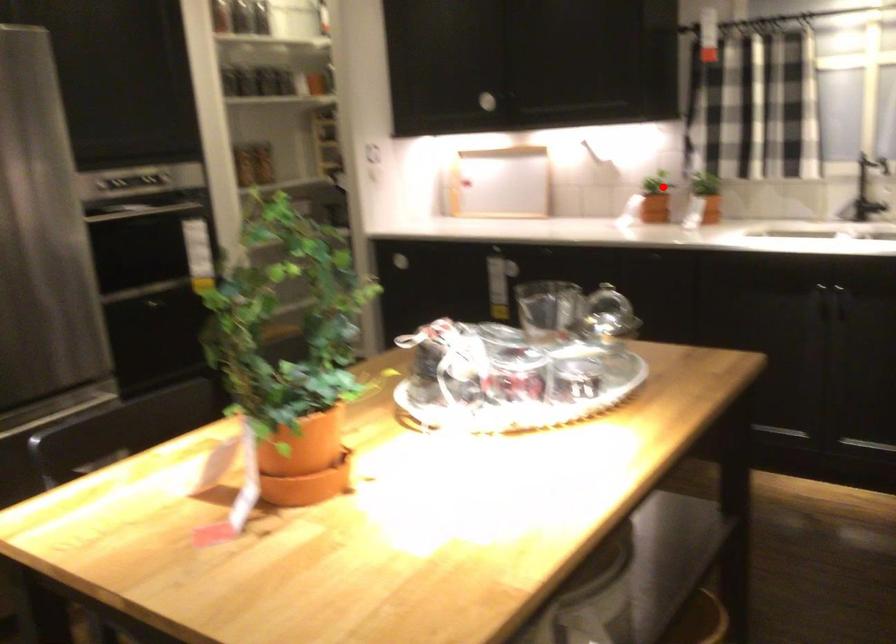
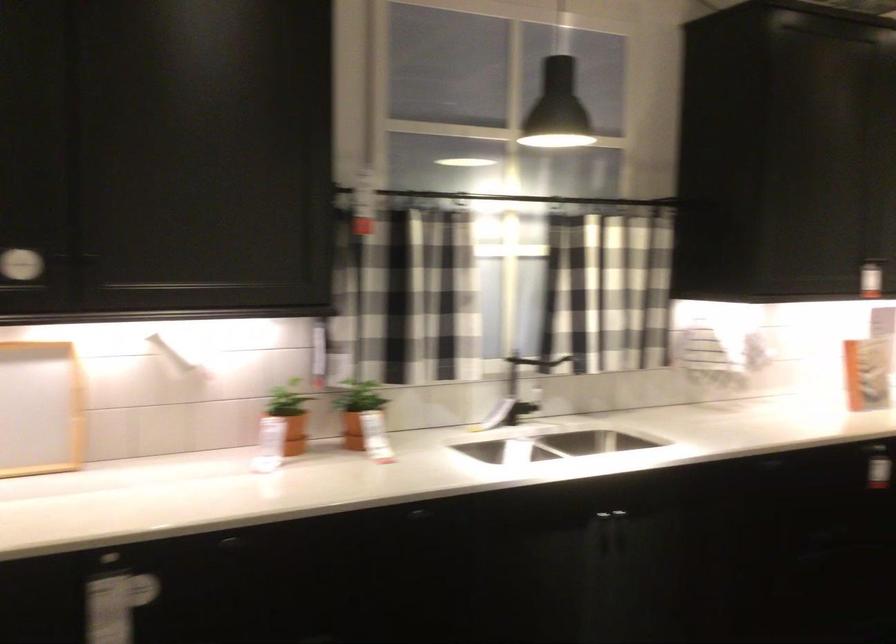
Locate, in the second image, the point that corresponds to the highlighted location in the first image.

(289, 415)